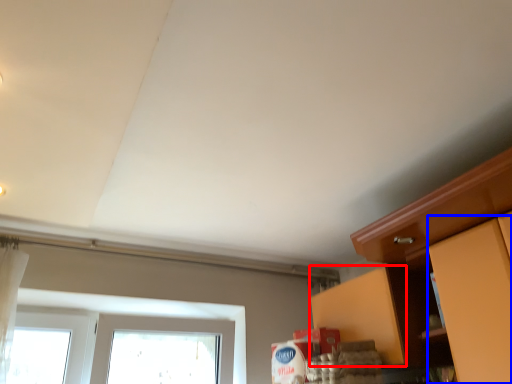
Question: Which object is closer to the camera taking this photo, cabinetry (highlighted by a red box) or cabinetry (highlighted by a blue box)?

Choices:
 (A) cabinetry
 (B) cabinetry

Answer: (B)